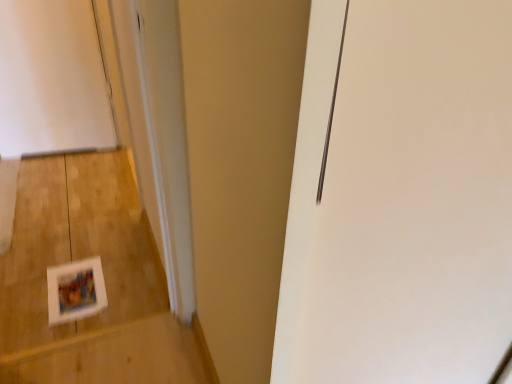
At what (x,y) coordinates should I click in order to perform the action: click on matte white postcard at lower left. Please return your answer as a coordinate pair (x, y). Looking at the image, I should click on (75, 290).

From the picture: What is the approximate height of matte white postcard at lower left?

The height of matte white postcard at lower left is 0.39 inches.

The image size is (512, 384). What do you see at coordinates (75, 290) in the screenshot?
I see `matte white postcard at lower left` at bounding box center [75, 290].

The height and width of the screenshot is (384, 512). I want to click on white matte frame at lower left, so click(x=104, y=277).

Measure the distance between white matte frame at lower left and camera.

The depth of white matte frame at lower left is 1.36 meters.

The width and height of the screenshot is (512, 384). Describe the element at coordinates (104, 277) in the screenshot. I see `white matte frame at lower left` at that location.

Where is `matte white postcard at lower left`? Image resolution: width=512 pixels, height=384 pixels. matte white postcard at lower left is located at coordinates (75, 290).

Consider the image. Between matte white postcard at lower left and white matte frame at lower left, which one appears on the left side from the viewer's perspective?

white matte frame at lower left is more to the left.

Looking at this image, which object is more forward, matte white postcard at lower left or white matte frame at lower left?

white matte frame at lower left is closer to the camera.

Does point (81, 310) lie behind point (163, 357)?

Yes, point (81, 310) is farther from viewer.

From the image's perspective, is matte white postcard at lower left located beneath white matte frame at lower left?

Indeed, from the image's perspective, matte white postcard at lower left is shown beneath white matte frame at lower left.

From a real-world perspective, is matte white postcard at lower left under white matte frame at lower left?

No, from a real-world perspective, matte white postcard at lower left is not beneath white matte frame at lower left.

Between matte white postcard at lower left and white matte frame at lower left, which one has larger width?

white matte frame at lower left is wider.

Is matte white postcard at lower left shorter than white matte frame at lower left?

Yes.

Which of these two, matte white postcard at lower left or white matte frame at lower left, is smaller?

With smaller size is matte white postcard at lower left.

Is matte white postcard at lower left completely or partially outside of white matte frame at lower left?

That's incorrect, matte white postcard at lower left is not completely outside white matte frame at lower left.

Is the surface of matte white postcard at lower left in direct contact with white matte frame at lower left?

No, matte white postcard at lower left is not touching white matte frame at lower left.

Is matte white postcard at lower left positioned with its back to white matte frame at lower left?

Yes.

How many degrees apart are the facing directions of matte white postcard at lower left and white matte frame at lower left?

There is a 1.21-degree angle between the facing directions of matte white postcard at lower left and white matte frame at lower left.

At what (x,y) coordinates should I click in order to perform the action: click on postcard behind the white matte frame at lower left. Please return your answer as a coordinate pair (x, y). Looking at the image, I should click on (75, 290).

Between white matte frame at lower left and matte white postcard at lower left, which one appears on the right side from the viewer's perspective?

From the viewer's perspective, matte white postcard at lower left appears more on the right side.

Is the position of white matte frame at lower left more distant than that of matte white postcard at lower left?

That is False.

Between point (77, 373) and point (74, 298), which one is positioned behind?

The point (74, 298) is farther.

From the image's perspective, between white matte frame at lower left and matte white postcard at lower left, who is located below?

matte white postcard at lower left appears lower in the image.

From a real-world perspective, is white matte frame at lower left positioned over matte white postcard at lower left based on gravity?

Actually, white matte frame at lower left is physically below matte white postcard at lower left in the real world.

Is white matte frame at lower left wider or thinner than matte white postcard at lower left?

Considering their sizes, white matte frame at lower left looks broader than matte white postcard at lower left.

Consider the image. Can you confirm if white matte frame at lower left is taller than matte white postcard at lower left?

Correct, white matte frame at lower left is much taller as matte white postcard at lower left.

Is white matte frame at lower left bigger or smaller than matte white postcard at lower left?

white matte frame at lower left is bigger than matte white postcard at lower left.

Is matte white postcard at lower left surrounded by white matte frame at lower left?

Indeed, matte white postcard at lower left is located within white matte frame at lower left.

Is white matte frame at lower left far from matte white postcard at lower left?

No.

Is white matte frame at lower left oriented away from matte white postcard at lower left?

No, matte white postcard at lower left is not at the back of white matte frame at lower left.

The image size is (512, 384). I want to click on postcard below the white matte frame at lower left (from the image's perspective), so click(x=75, y=290).

At what (x,y) coordinates should I click in order to perform the action: click on stairwell lying on the left of matte white postcard at lower left. Please return your answer as a coordinate pair (x, y). This screenshot has height=384, width=512. Looking at the image, I should click on (104, 277).

The image size is (512, 384). Identify the location of stairwell above the matte white postcard at lower left (from the image's perspective). (104, 277).